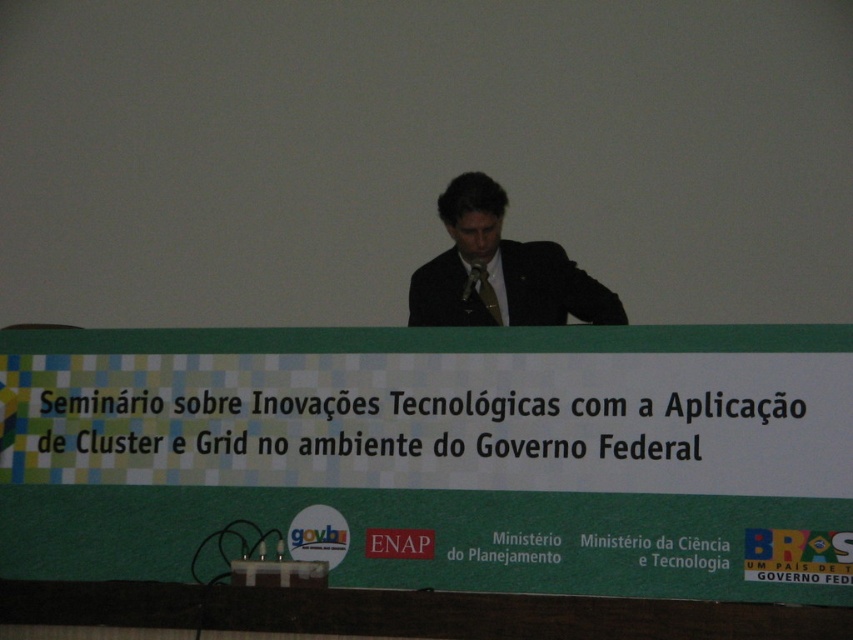
Question: Can you confirm if matte black suit at center is positioned above matte brown tie at center?

Choices:
 (A) yes
 (B) no

Answer: (A)

Question: Which point is farther from the camera taking this photo?

Choices:
 (A) (596, 474)
 (B) (468, 284)

Answer: (B)

Question: Can you confirm if green fabric banner at center is thinner than matte brown tie at center?

Choices:
 (A) yes
 (B) no

Answer: (B)

Question: Among these objects, which one is farthest from the camera?

Choices:
 (A) matte brown tie at center
 (B) matte black suit at center

Answer: (A)

Question: Which of the following is the closest to the observer?

Choices:
 (A) green fabric banner at center
 (B) matte brown tie at center
 (C) matte black suit at center

Answer: (A)

Question: Is green fabric banner at center further to camera compared to matte black suit at center?

Choices:
 (A) no
 (B) yes

Answer: (A)